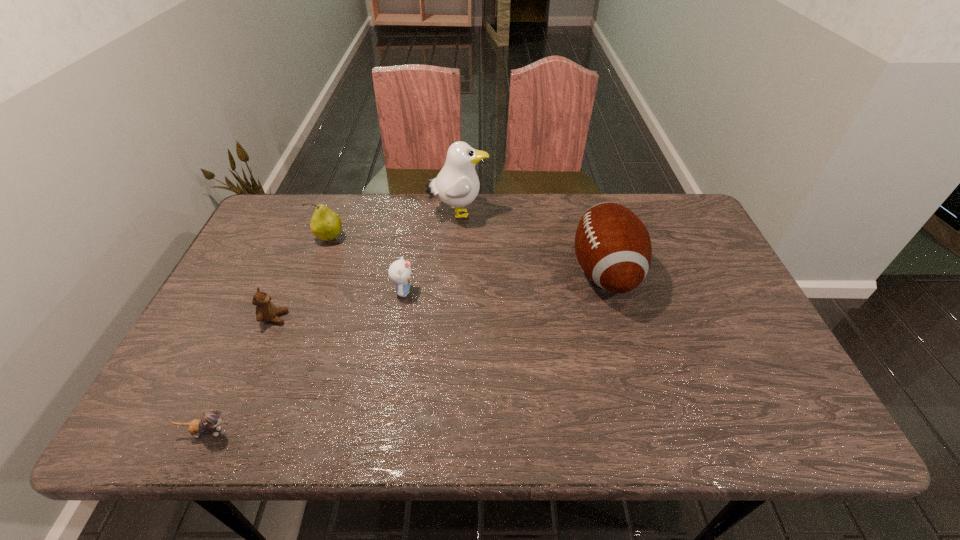
Identify the location of vacant space at the far right corner of the desktop. This screenshot has height=540, width=960. (684, 233).

The image size is (960, 540). What are the coordinates of `free space that is in between the third tallest object and the left kitten` in the screenshot? It's located at (268, 335).

This screenshot has width=960, height=540. I want to click on blank region between the right kitten and the pear, so [367, 265].

Locate an element on the screen. The image size is (960, 540). vacant space that's between the teddy bear and the rightmost object is located at coordinates (440, 295).

The image size is (960, 540). Find the location of `vacant area between the nearest object and the farthest object`. vacant area between the nearest object and the farthest object is located at coordinates (332, 323).

Locate an element on the screen. vacant space in between the fourth shortest object and the tallest object is located at coordinates (394, 226).

Find the location of `free space between the fifth shortest object and the nearest object`. free space between the fifth shortest object and the nearest object is located at coordinates (406, 352).

Image resolution: width=960 pixels, height=540 pixels. In order to click on empty space that is in between the teddy bear and the left kitten in this screenshot , I will do `click(241, 375)`.

Identify the location of vacant area between the rightmost object and the shorter kitten. (406, 352).

The width and height of the screenshot is (960, 540). What are the coordinates of `empty space between the football and the right kitten` in the screenshot? It's located at (504, 282).